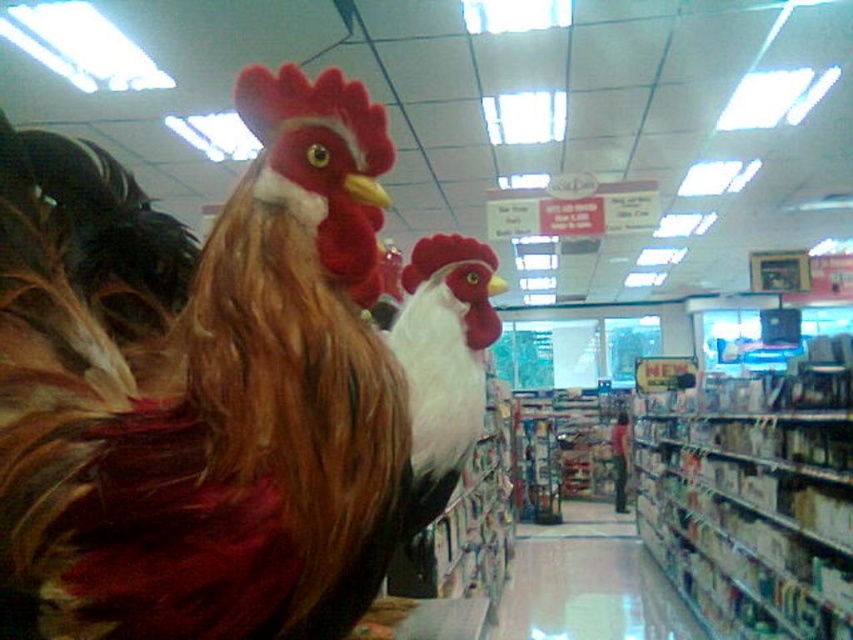
The image size is (853, 640). Describe the element at coordinates (199, 385) in the screenshot. I see `matte brown rooster at left` at that location.

Which is in front, point (137, 612) or point (624, 461)?

Point (137, 612)

Image resolution: width=853 pixels, height=640 pixels. In order to click on matte brown rooster at left in this screenshot , I will do `click(199, 385)`.

Is white cardboard boxes at center closer to camera compared to white glossy aisle at center?

Yes.

Is point (815, 451) positioned after point (592, 584)?

No, (815, 451) is in front of (592, 584).

Is point (693, 516) closer to camera compared to point (541, 556)?

Yes.

Locate an element on the screen. white cardboard boxes at center is located at coordinates (753, 500).

Does white cardboard boxes at center have a larger size compared to white matte rooster at center?

Correct, white cardboard boxes at center is larger in size than white matte rooster at center.

Can you confirm if white cardboard boxes at center is wider than white matte rooster at center?

Indeed, white cardboard boxes at center has a greater width compared to white matte rooster at center.

The image size is (853, 640). Identify the location of white cardboard boxes at center. (753, 500).

You are a GUI agent. You are given a task and a screenshot of the screen. Output one action in this format:
    pyautogui.click(x=<x>, y=<y>)
    Task: Click on the white cardboard boxes at center
    The height and width of the screenshot is (640, 853).
    Given the screenshot: What is the action you would take?
    pyautogui.click(x=753, y=500)